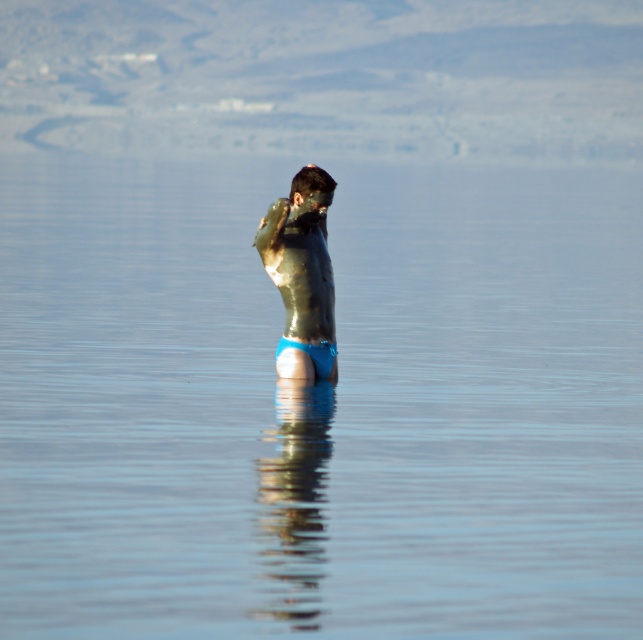
Is shiny metallic man at center to the right of blue fabric at center from the viewer's perspective?

In fact, shiny metallic man at center is to the left of blue fabric at center.

Does shiny metallic man at center appear under blue fabric at center?

No.

Describe the element at coordinates (302, 275) in the screenshot. I see `shiny metallic man at center` at that location.

Where is `shiny metallic man at center`? The image size is (643, 640). shiny metallic man at center is located at coordinates (302, 275).